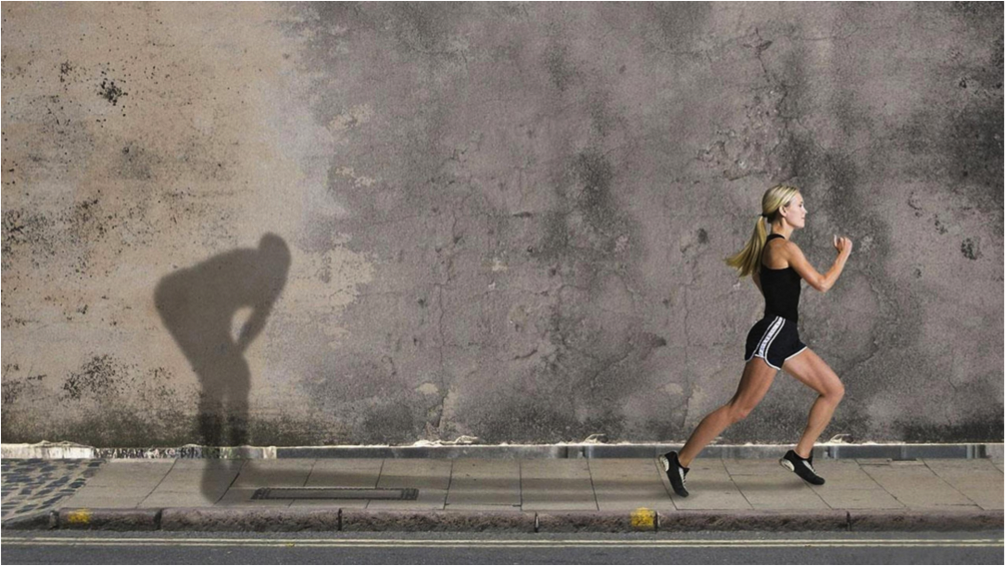
Find the location of a particular element. grey wall is located at coordinates (494, 210), (857, 72).